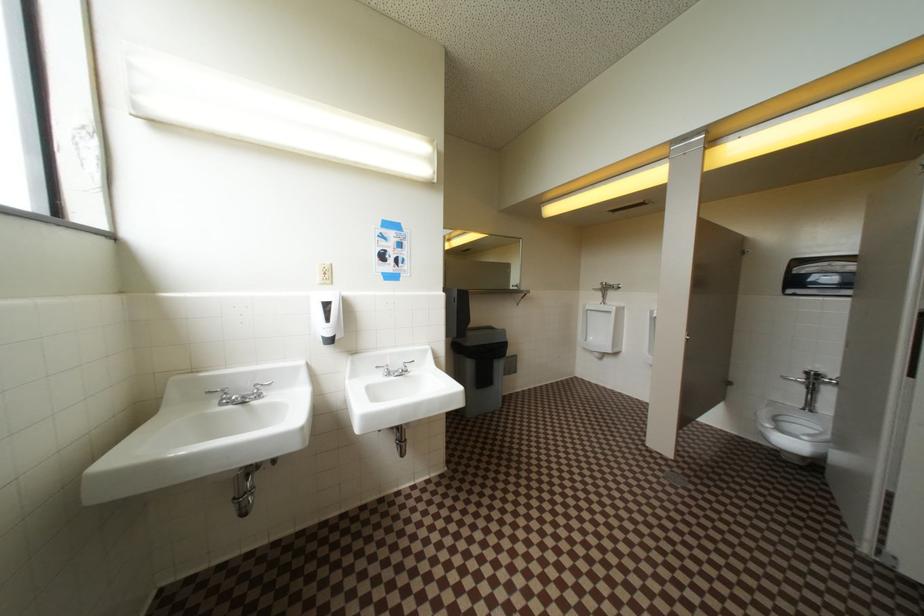
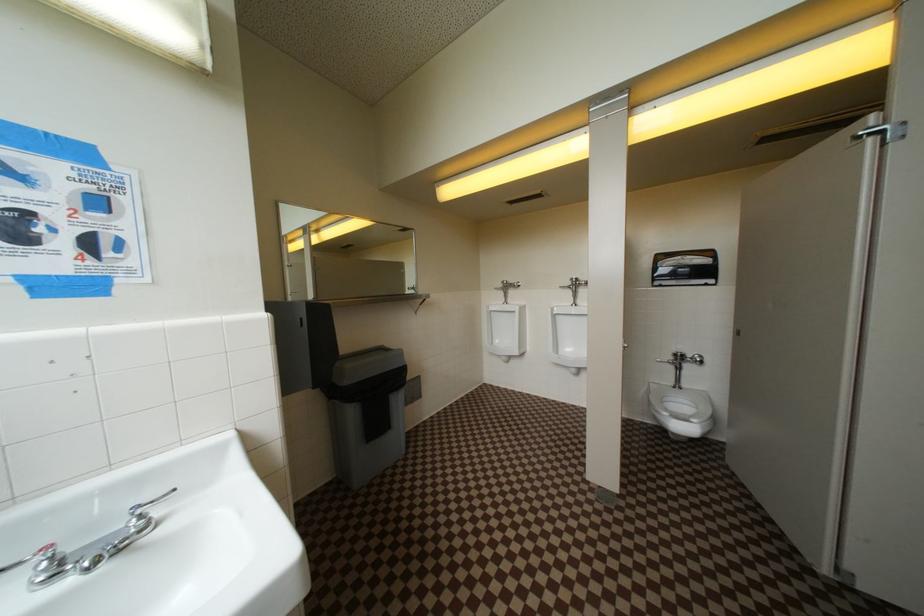
Question: The camera is either moving clockwise (left) or counter-clockwise (right) around the object. The first image is from the beginning of the video and the second image is from the end. Is the camera moving left or right when shooting the video?

Choices:
 (A) Left
 (B) Right

Answer: (A)